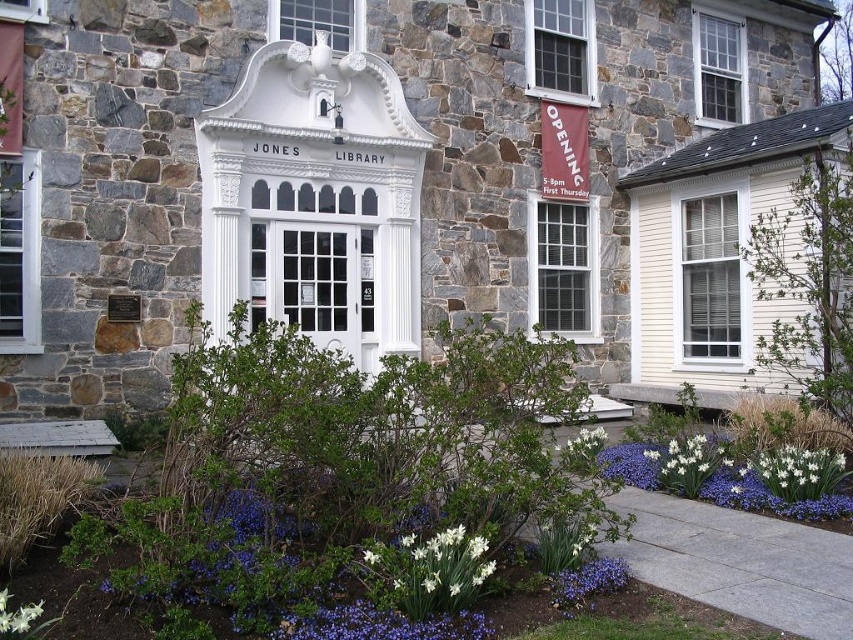
Question: Among these objects, which one is nearest to the camera?

Choices:
 (A) blue matte flower at lower center
 (B) white glossy flower at lower right
 (C) white glossy flower at lower left

Answer: (C)

Question: Is white glossy flower at lower right bigger than white matte flower at center?

Choices:
 (A) no
 (B) yes

Answer: (B)

Question: Does white glossy flower at center appear on the left side of blue matte flower at lower center?

Choices:
 (A) yes
 (B) no

Answer: (A)

Question: Which point is closer to the camera?

Choices:
 (A) white matte flower at center
 (B) white glossy flower at lower left

Answer: (B)

Question: Which object is farther from the camera taking this photo?

Choices:
 (A) white matte flower at center
 (B) white glossy flower at lower right
 (C) white glossy flower at lower left

Answer: (A)

Question: Can you confirm if white glossy flower at center is positioned to the left of white glossy flower at lower right?

Choices:
 (A) yes
 (B) no

Answer: (A)